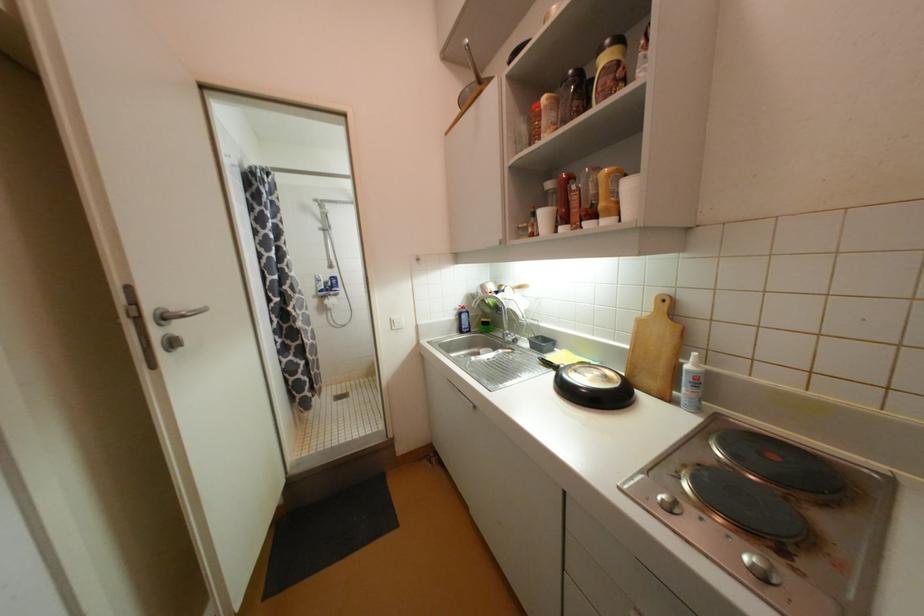
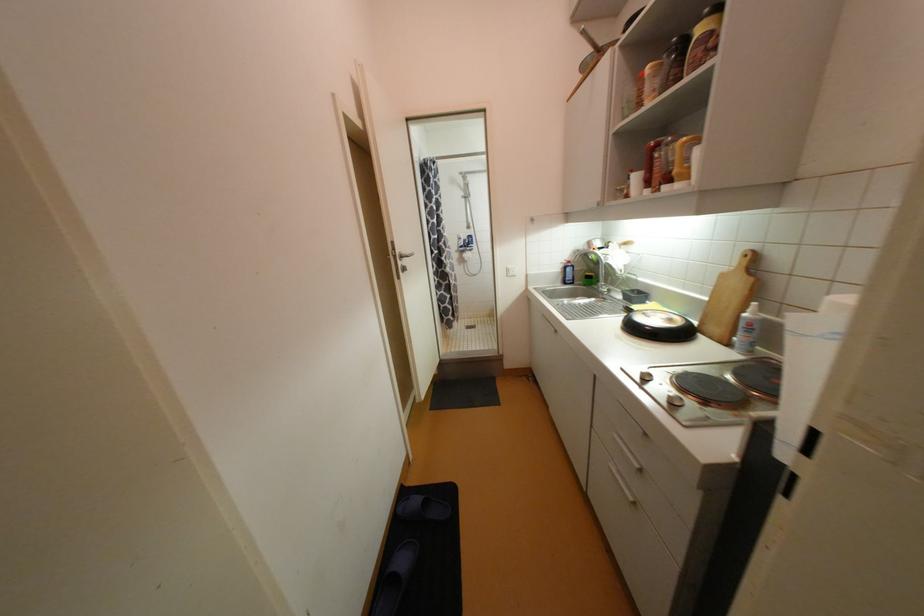
In the second image, find the point that corresponds to pixel 466 331 in the first image.

(569, 283)